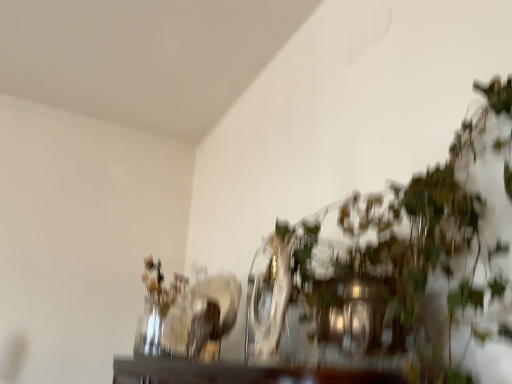
This screenshot has height=384, width=512. Identify the location of green leafy plant at upper right. (397, 273).

The image size is (512, 384). What do you see at coordinates (397, 273) in the screenshot?
I see `green leafy plant at upper right` at bounding box center [397, 273].

Locate an element on the screen. green leafy plant at upper right is located at coordinates (397, 273).